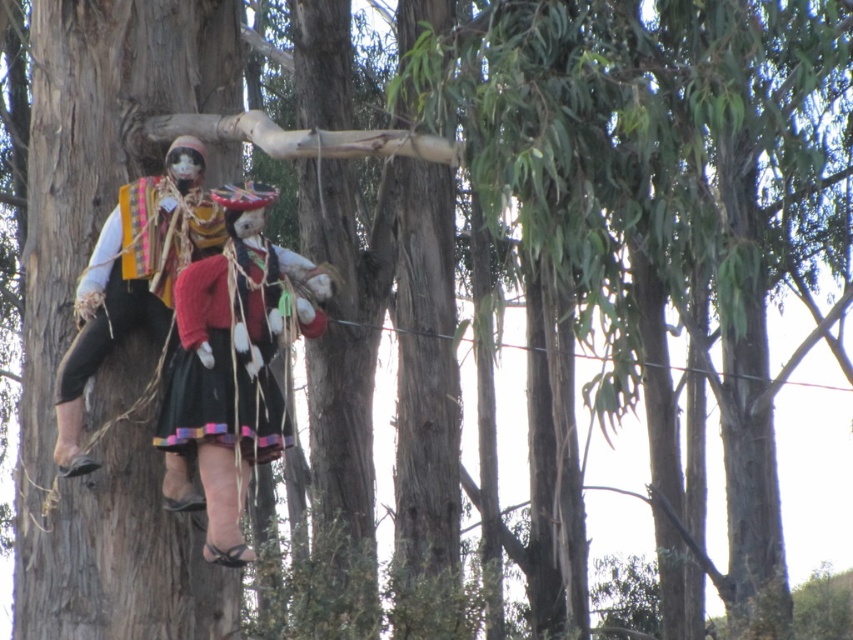
Between point (196, 406) and point (74, 352), which one is positioned behind?

Point (74, 352)

Does matte black dress at center have a greater width compared to textured fabric doll at center?

No.

Which is in front, point (175, 401) or point (213, 234)?

Point (175, 401)

In order to click on matte black dress at center in this screenshot , I will do `click(230, 355)`.